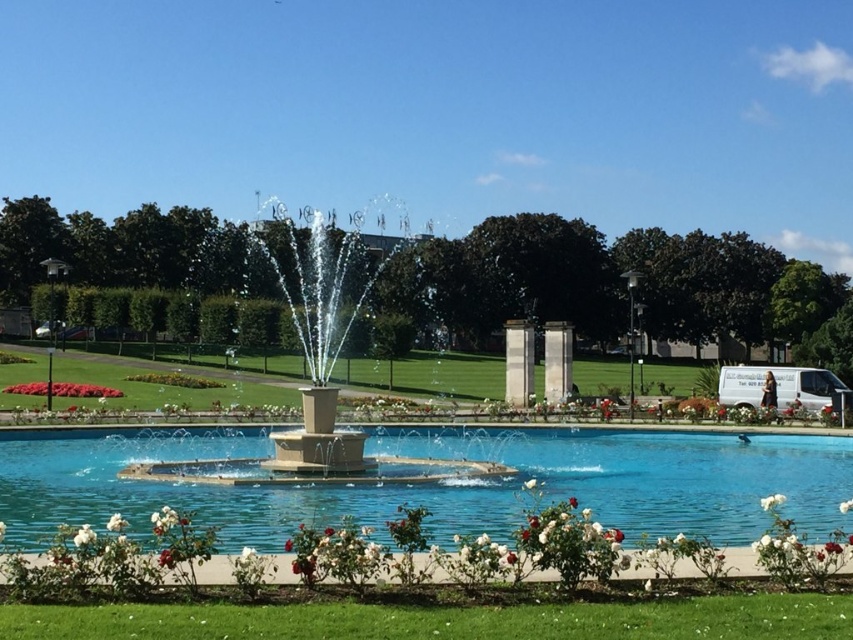
Question: Estimate the real-world distances between objects in this image. Which object is farther from the white matte flower at center?

Choices:
 (A) clear glass water at center
 (B) white matte flower at lower center

Answer: (B)

Question: Which of these objects is positioned closest to the white matte flower at lower center?

Choices:
 (A) white matte flower at center
 (B) red matte flowers at lower left
 (C) clear glass water at center

Answer: (C)

Question: Which object is the closest to the clear glass water at center?

Choices:
 (A) white fluffy flower at lower left
 (B) white matte flower at center

Answer: (B)

Question: From the image, what is the correct spatial relationship of clear glass water at center in relation to white fluffy flower at lower left?

Choices:
 (A) above
 (B) below

Answer: (B)

Question: Is red matte flowers at lower left smaller than white matte flower at lower center?

Choices:
 (A) no
 (B) yes

Answer: (A)

Question: Is red matte flowers at lower left positioned behind white matte flower at lower center?

Choices:
 (A) yes
 (B) no

Answer: (A)